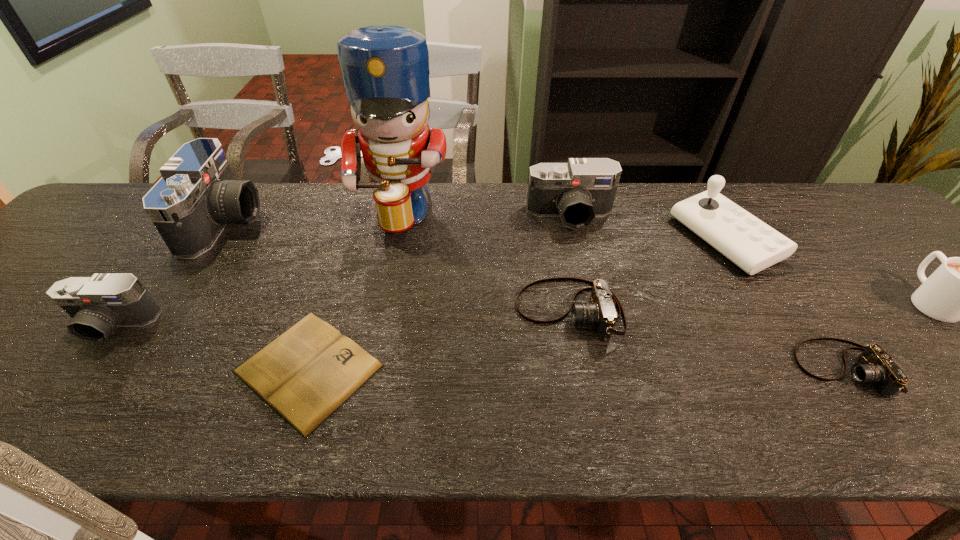
Where is `vacant region at the far edge`? The image size is (960, 540). vacant region at the far edge is located at coordinates (636, 194).

Locate an element on the screen. Image resolution: width=960 pixels, height=540 pixels. free region at the near edge of the desktop is located at coordinates (799, 400).

I want to click on vacant space at the right edge of the desktop, so click(x=897, y=241).

Image resolution: width=960 pixels, height=540 pixels. What are the coordinates of `free point between the tallest object and the rightmost camera` in the screenshot? It's located at (617, 290).

You are a GUI agent. You are given a task and a screenshot of the screen. Output one action in this format:
    pyautogui.click(x=<x>, y=<y>)
    Task: Click on the blank region between the smallest black camera and the tallest camera
    This screenshot has height=540, width=960.
    Given the screenshot: What is the action you would take?
    pyautogui.click(x=169, y=274)

Find the location of a particular element. Image resolution: width=960 pixels, height=540 pixels. vacant area that lies between the third shortest object and the shortest object is located at coordinates (439, 340).

What are the coordinates of `free space between the third shortest camera and the third shortest object` in the screenshot? It's located at (341, 318).

Identify the location of blank region between the blue nutcracker and the third shortest object. The height and width of the screenshot is (540, 960). (480, 261).

Where is `free spot between the nearest black camera and the right brown camera`? Image resolution: width=960 pixels, height=540 pixels. free spot between the nearest black camera and the right brown camera is located at coordinates (478, 347).

Where is `free space between the fourth shortest camera and the shortest object`? Image resolution: width=960 pixels, height=540 pixels. free space between the fourth shortest camera and the shortest object is located at coordinates (439, 292).